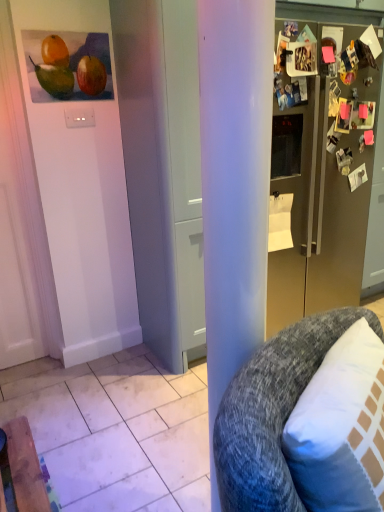
Question: Is white matte door at center bigger or smaller than matte orange at upper left?

Choices:
 (A) big
 (B) small

Answer: (A)

Question: Is white matte door at center in front of or behind matte orange at upper left in the image?

Choices:
 (A) behind
 (B) front

Answer: (B)

Question: Which object is the farthest from the gray textured cushion at right?

Choices:
 (A) satin gold refrigerator at right
 (B) white matte door at center
 (C) matte orange at upper left

Answer: (C)

Question: Based on their relative distances, which object is nearer to the matte orange at upper left?

Choices:
 (A) white matte door at center
 (B) satin gold refrigerator at right
 (C) gray textured cushion at right

Answer: (A)